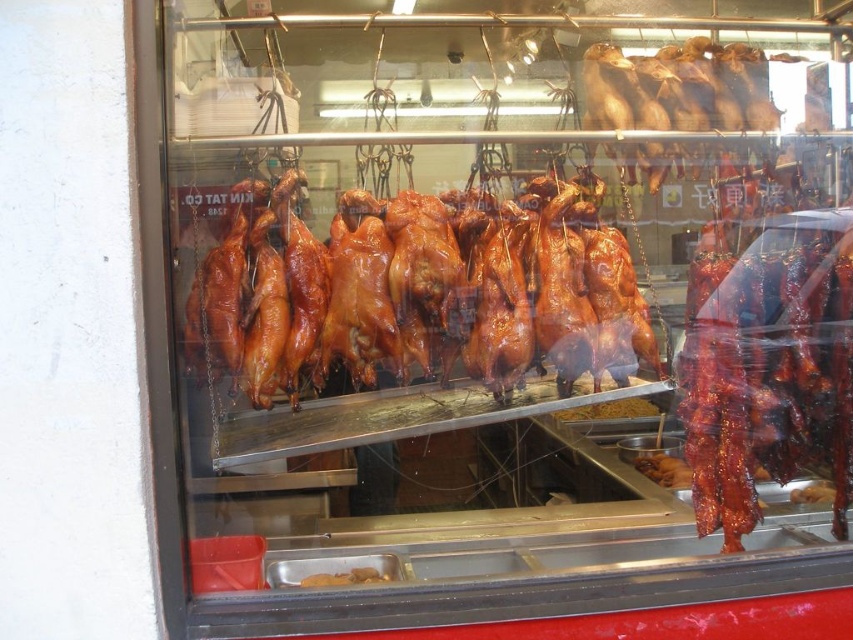
Which is below, shiny brown duck at center or brown glossy duck at center?

shiny brown duck at center is below.

Is shiny brown duck at center bigger than brown glossy duck at center?

Yes.

Is point (611, 353) more distant than point (633, 93)?

No, it is in front of (633, 93).

This screenshot has width=853, height=640. I want to click on shiny brown duck at center, so click(415, 291).

Is brown glossy duck at center shorter than brown glossy roasted duck at center?

Incorrect, brown glossy duck at center's height does not fall short of brown glossy roasted duck at center's.

In the scene shown: Can you confirm if brown glossy duck at center is smaller than brown glossy roasted duck at center?

No, brown glossy duck at center is not smaller than brown glossy roasted duck at center.

Between point (657, 106) and point (570, 412), which one is positioned behind?

Positioned behind is point (570, 412).

You are a GUI agent. You are given a task and a screenshot of the screen. Output one action in this format:
    pyautogui.click(x=<x>, y=<y>)
    Task: Click on the brown glossy duck at center
    Image resolution: width=853 pixels, height=640 pixels.
    Given the screenshot: What is the action you would take?
    pyautogui.click(x=677, y=88)

Does brown glossy duck at center have a larger size compared to brown glossy meat at lower center?

→ Correct, brown glossy duck at center is larger in size than brown glossy meat at lower center.

Who is more distant from viewer, (664,104) or (334,579)?

The point (664,104) is behind.

Does point (640, 56) lie in front of point (344, 580)?

No, it is behind (344, 580).

This screenshot has width=853, height=640. In order to click on brown glossy duck at center in this screenshot , I will do click(677, 88).